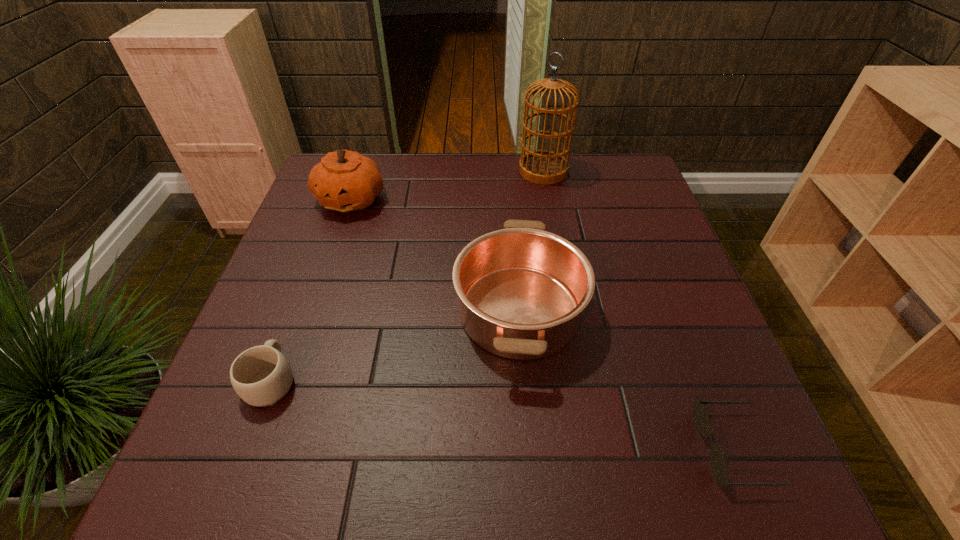
Identify the location of free space between the mug and the birdcage. Image resolution: width=960 pixels, height=540 pixels. (407, 275).

You are a GUI agent. You are given a task and a screenshot of the screen. Output one action in this format:
    pyautogui.click(x=<x>, y=<y>)
    Task: Click on the blank region between the mug and the tallest object
    Image resolution: width=960 pixels, height=540 pixels.
    Given the screenshot: What is the action you would take?
    pyautogui.click(x=407, y=275)

Find the location of `free space between the second shortest object and the birdcage`. free space between the second shortest object and the birdcage is located at coordinates (407, 275).

Find the location of `vacant region between the saucepan and the mug`. vacant region between the saucepan and the mug is located at coordinates (396, 346).

Identify which object is the fourth closest to the sunglasses. Please provide its 2D coordinates. Your answer should be formatted as a tuple, i.e. [(x, y)], where the tuple contains the x and y coordinates of a point satisfying the conditions above.

[(345, 181)]

Locate which object is the closest to the mug. Please provide its 2D coordinates. Your answer should be formatted as a tuple, i.e. [(x, y)], where the tuple contains the x and y coordinates of a point satisfying the conditions above.

[(522, 290)]

The width and height of the screenshot is (960, 540). I want to click on vacant region that satisfies the following two spatial constraints: 1. on the side of the third tallest object with the handle; 2. on the left side of the fourth tallest object, so click(x=298, y=311).